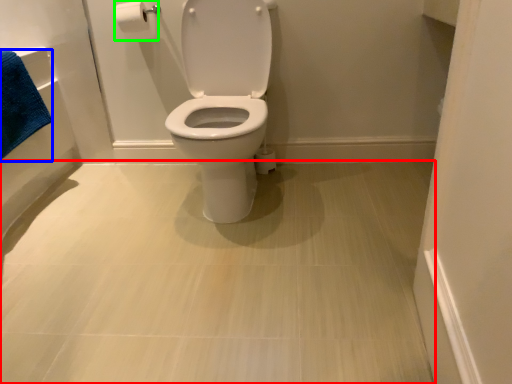
Question: Which object is the closest to the plain (highlighted by a red box)? Choose among these: bath towel (highlighted by a blue box) or toilet paper (highlighted by a green box).

Choices:
 (A) bath towel
 (B) toilet paper

Answer: (A)